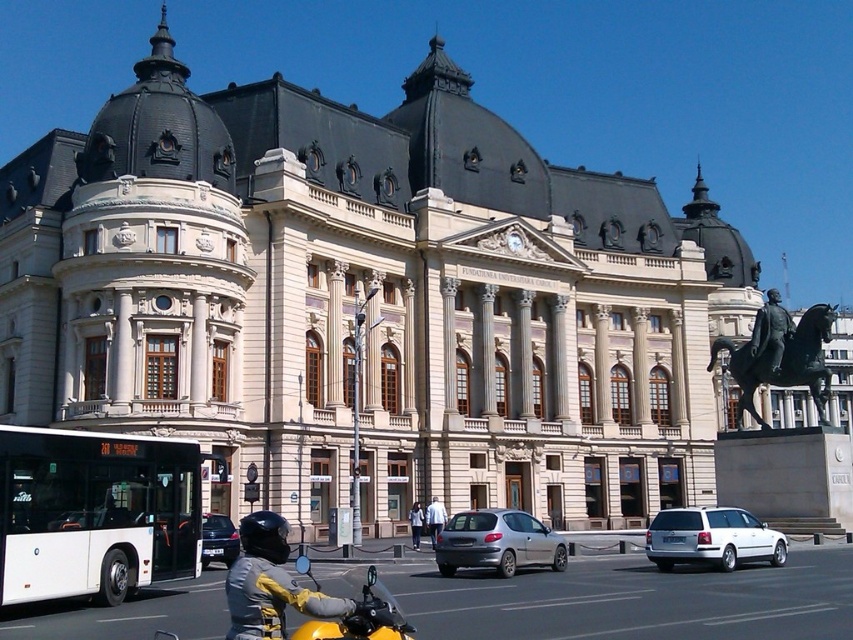
Question: Which of the following is the farthest from the observer?

Choices:
 (A) (648, 557)
 (B) (445, 525)
 (C) (438, 516)

Answer: (C)

Question: Can you confirm if metallic silver car at center is positioned above yellow matte motorcycle at lower center?

Choices:
 (A) no
 (B) yes

Answer: (A)

Question: Among these objects, which one is farthest from the camera?

Choices:
 (A) yellow matte motorcycle at lower center
 (B) white metallic car at lower right
 (C) silver metallic sedan at center
 (D) white matte bus at lower left

Answer: (C)

Question: Can you confirm if yellow matte motorcycle at lower center is positioned below silver metallic sedan at center?

Choices:
 (A) no
 (B) yes

Answer: (A)

Question: Estimate the real-world distances between objects in this image. Which object is farther from the white matte bus at lower left?

Choices:
 (A) white metallic car at lower right
 (B) white fabric jacket at lower center
 (C) silver metallic sedan at center
 (D) light blue fabric jacket at center

Answer: (B)

Question: Is white metallic car at lower right thinner than white fabric jacket at lower center?

Choices:
 (A) no
 (B) yes

Answer: (A)